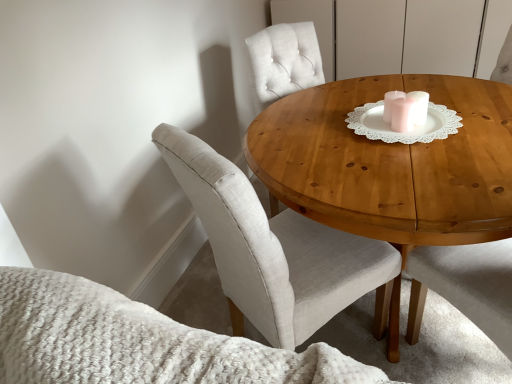
Question: From a real-world perspective, is white lace doily at center above or below light beige fabric chair at center?

Choices:
 (A) above
 (B) below

Answer: (A)

Question: Looking at their shapes, would you say white lace doily at center is wider or thinner than light beige fabric chair at center?

Choices:
 (A) thin
 (B) wide

Answer: (A)

Question: Based on their relative distances, which object is farther from the white lace doily at center?

Choices:
 (A) light beige fabric chair at center
 (B) wooden table at center

Answer: (A)

Question: Which object is positioned farthest from the light beige fabric chair at center?

Choices:
 (A) white lace doily at center
 (B) wooden table at center

Answer: (A)